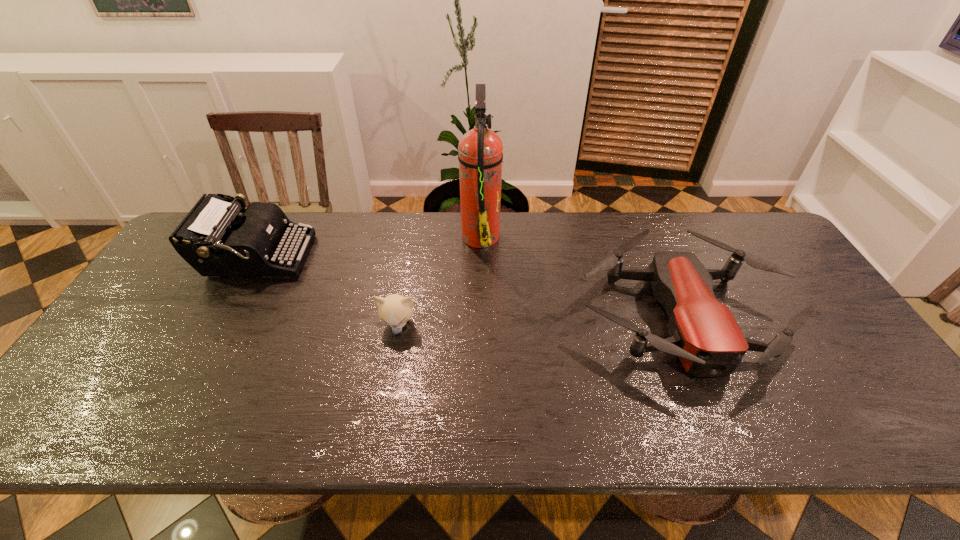
This screenshot has height=540, width=960. I want to click on free point located 0.120m on the front-facing side of the rightmost object, so click(x=736, y=441).

Where is `free spot located 0.250m on the face of the third object from right to left`? This screenshot has width=960, height=540. free spot located 0.250m on the face of the third object from right to left is located at coordinates click(x=380, y=429).

You are a GUI agent. You are given a task and a screenshot of the screen. Output one action in this format:
    pyautogui.click(x=<x>, y=<y>)
    Task: Click on the fire extinguisher that is at the far edge
    The image size is (960, 540).
    Given the screenshot: What is the action you would take?
    pyautogui.click(x=480, y=155)

Identify the location of typewriter that is at the far edge. click(213, 238).

Where is `drone present at the far edge`? The height and width of the screenshot is (540, 960). drone present at the far edge is located at coordinates (704, 334).

Locate an element on the screen. The height and width of the screenshot is (540, 960). object at the left edge is located at coordinates click(x=213, y=238).

Where is `object at the right edge`? object at the right edge is located at coordinates (x=704, y=334).

Identify the location of object that is at the far left corner. (213, 238).

This screenshot has width=960, height=540. Identify the location of object located at the far right corner. (704, 334).

The image size is (960, 540). Identify the location of free region at the far edge of the desktop. (412, 247).